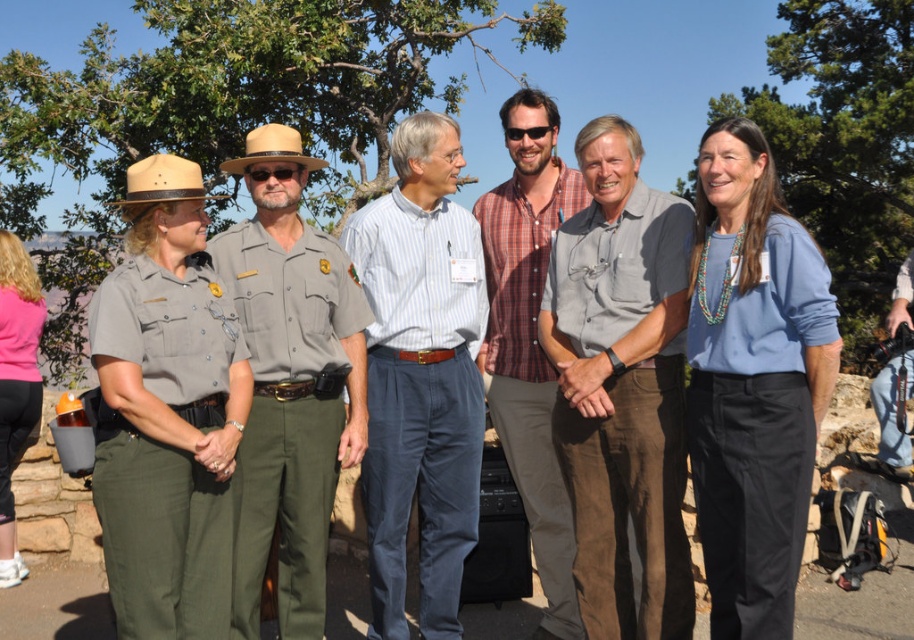
Question: Is light blue striped shirt at center bigger than plaid cotton shirt at center?

Choices:
 (A) yes
 (B) no

Answer: (A)

Question: Is gray cotton shirt at center smaller than plaid cotton shirt at center?

Choices:
 (A) no
 (B) yes

Answer: (B)

Question: Is gray cotton shirt at center wider than gray uniform at center?

Choices:
 (A) no
 (B) yes

Answer: (A)

Question: Which point is closer to the camera taking this photo?

Choices:
 (A) (492, 368)
 (B) (468, 282)
 (C) (139, 356)
 (D) (307, 376)

Answer: (C)

Question: Which point is closer to the camera taking this photo?

Choices:
 (A) (415, 353)
 (B) (285, 141)
 (C) (213, 404)

Answer: (C)

Question: Estimate the real-world distances between objects in this image. Which object is closer to the blue cotton shirt at center?

Choices:
 (A) light blue striped shirt at center
 (B) matte khaki uniform at left
 (C) plaid cotton shirt at center
 (D) gray uniform at center

Answer: (C)